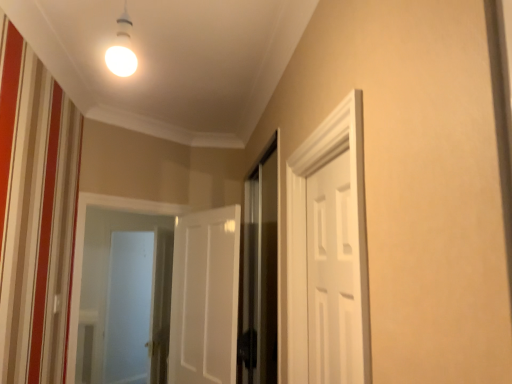
Question: Is white matte door at center, which is the 2th door in front-to-back order, taller or shorter than transparent glass screen door at center, acting as the second screen door starting from the left?

Choices:
 (A) short
 (B) tall

Answer: (A)

Question: In terms of width, does white matte door at center, which is the first door in back-to-front order, look wider or thinner when compared to transparent glass screen door at center, which ranks as the 1th screen door in front-to-back order?

Choices:
 (A) thin
 (B) wide

Answer: (B)

Question: Based on their relative distances, which object is nearer to the frosted glass screen door at left, the 2th screen door viewed from the right?

Choices:
 (A) transparent glass screen door at center, acting as the second screen door starting from the back
 (B) white matte door at right, marked as the 1th door in a right-to-left arrangement
 (C) white matte door at center, which is the 2th door in front-to-back order

Answer: (C)

Question: Which object is positioned farthest from the transparent glass screen door at center, which ranks as the 1th screen door in front-to-back order?

Choices:
 (A) white matte door at center, positioned as the first door in left-to-right order
 (B) frosted glass screen door at left, the 2th screen door viewed from the right
 (C) white matte door at right, acting as the first door starting from the front

Answer: (B)